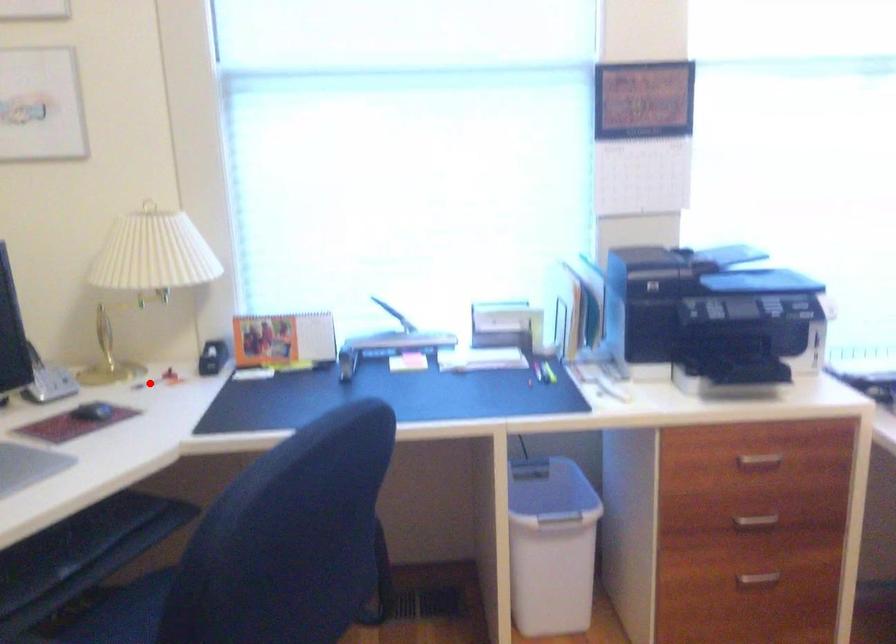
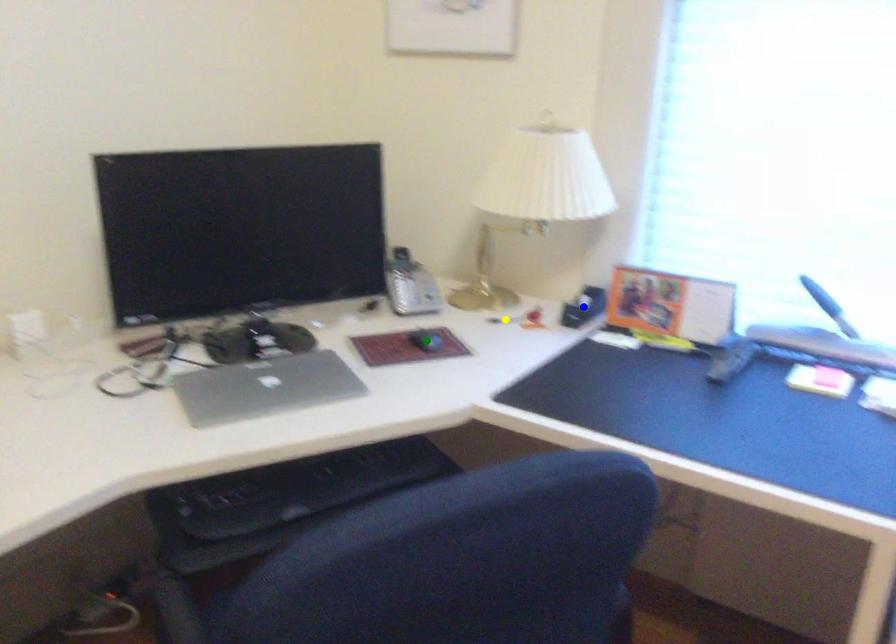
Question: I am providing you with two images of the same scene from different viewpoints. A red point is marked on the first image. You are given multiple points on the second image. In image 2, which mark is for the same physical point as the one in image 1?

Choices:
 (A) blue point
 (B) yellow point
 (C) green point

Answer: (B)